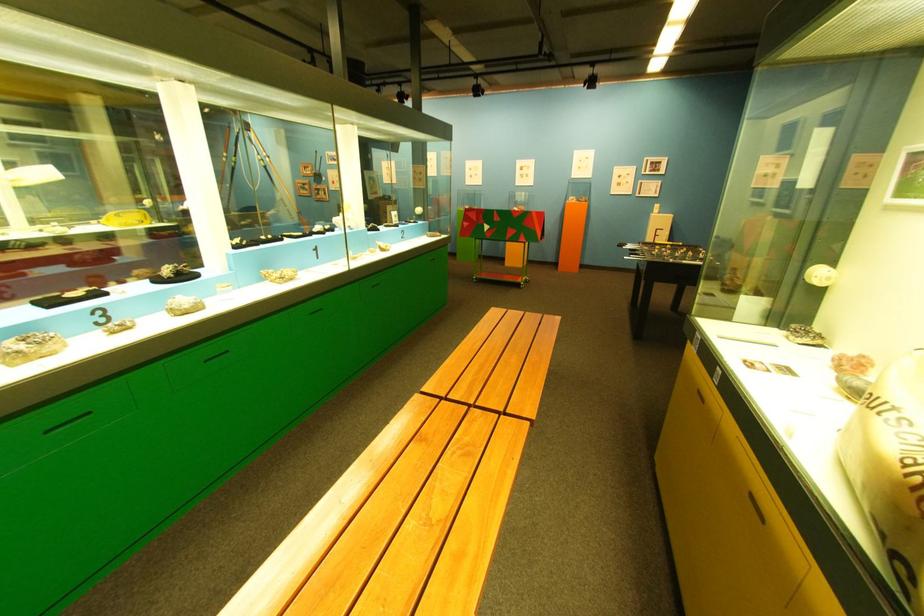
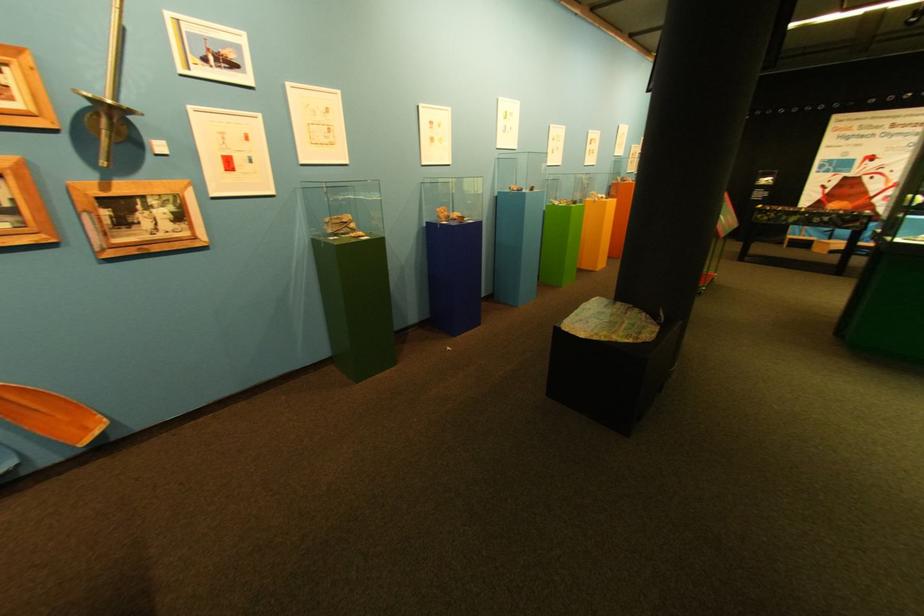
Locate, in the second image, the point that corresponds to (325,169) in the first image.

(22, 81)